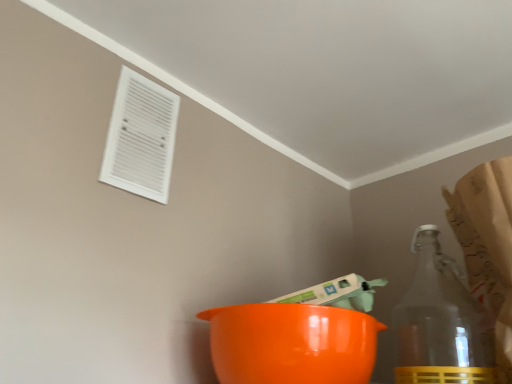
The width and height of the screenshot is (512, 384). What do you see at coordinates (141, 138) in the screenshot?
I see `white plastic vent at upper left` at bounding box center [141, 138].

Locate an element on the screen. white plastic vent at upper left is located at coordinates (141, 138).

Locate an element on the screen. white plastic vent at upper left is located at coordinates (141, 138).